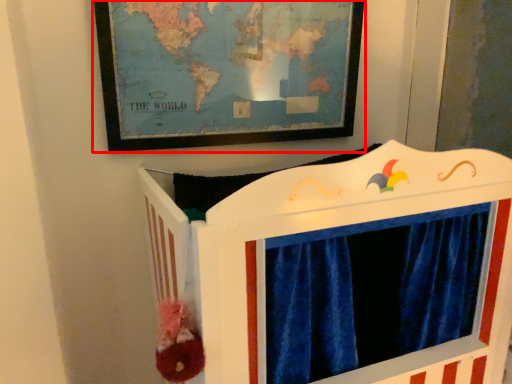
Question: From the image's perspective, where is picture frame (annotated by the red box) located in relation to furniture in the image?

Choices:
 (A) above
 (B) below

Answer: (A)